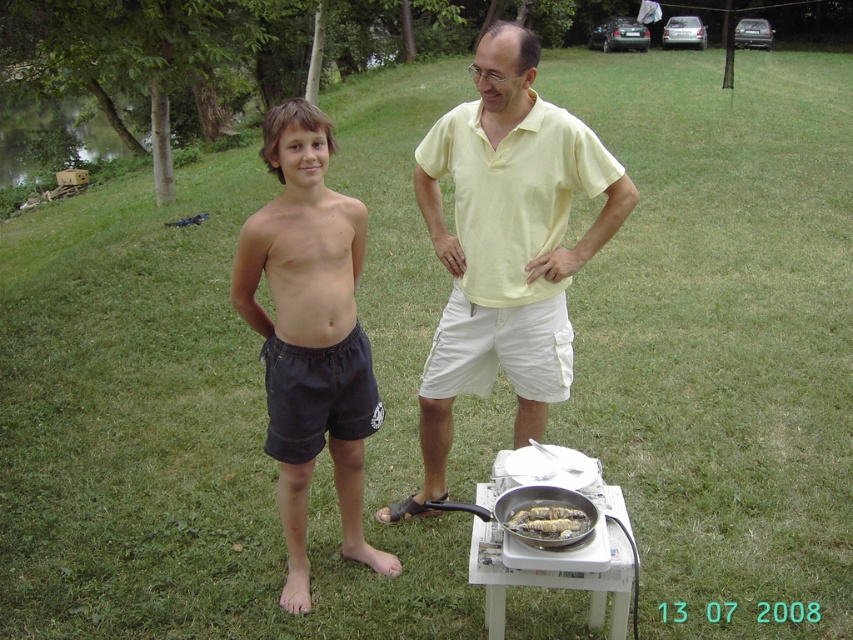
Is dark blue shorts at center above dark cotton shorts at center?

Yes, dark blue shorts at center is above dark cotton shorts at center.

Is point (317, 224) closer to viewer compared to point (364, 348)?

Yes, it is.

Is point (364, 244) more distant than point (322, 358)?

Yes, point (364, 244) is behind point (322, 358).

I want to click on dark blue shorts at center, so click(x=310, y=333).

Is point (546, 150) farther from camera compared to point (428, 502)?

No, it is in front of (428, 502).

Locate an element on the screen. The image size is (853, 640). yellow cotton shirt at center is located at coordinates (505, 246).

Where is `yellow cotton shirt at center`? The height and width of the screenshot is (640, 853). yellow cotton shirt at center is located at coordinates (505, 246).

At what (x,y) coordinates should I click in order to perform the action: click on yellow cotton shirt at center. Please return your answer as a coordinate pair (x, y). Looking at the image, I should click on (505, 246).

The width and height of the screenshot is (853, 640). In order to click on dark cotton shorts at center in this screenshot , I will do `click(318, 396)`.

Who is more distant from viewer, (x=370, y=412) or (x=589, y=522)?

The point (x=370, y=412) is behind.

Does point (283, 440) lie behind point (587, 531)?

Yes, it is behind point (587, 531).

In order to click on dark cotton shorts at center in this screenshot , I will do `click(318, 396)`.